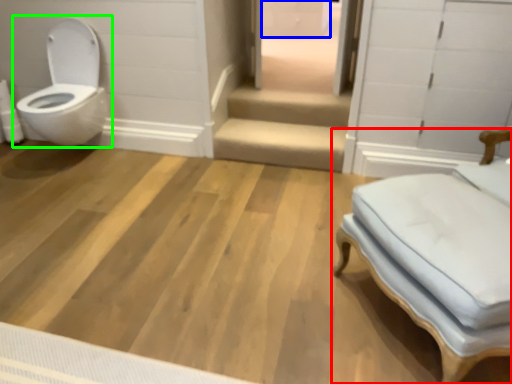
Question: Based on their relative distances, which object is farther from furniture (highlighted by a red box)? Choose from drawer (highlighted by a blue box) and toilet (highlighted by a green box).

Choices:
 (A) drawer
 (B) toilet

Answer: (A)